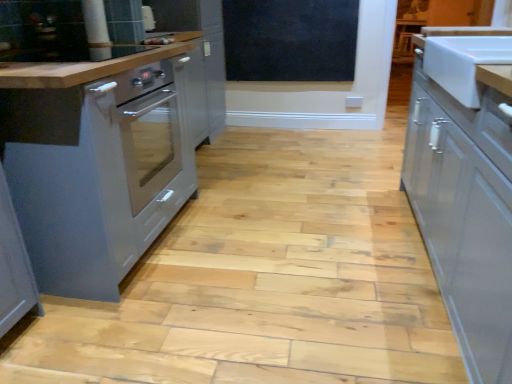
Question: Does white glossy sink at right have a lesser width compared to black matte chalkboard at upper center?

Choices:
 (A) no
 (B) yes

Answer: (A)

Question: From a real-world perspective, is white glossy sink at right physically below black matte chalkboard at upper center?

Choices:
 (A) no
 (B) yes

Answer: (A)

Question: Does white glossy sink at right have a greater width compared to black matte chalkboard at upper center?

Choices:
 (A) no
 (B) yes

Answer: (B)

Question: Can you confirm if white glossy sink at right is taller than black matte chalkboard at upper center?

Choices:
 (A) yes
 (B) no

Answer: (B)

Question: Is white glossy sink at right closer to the viewer compared to black matte chalkboard at upper center?

Choices:
 (A) yes
 (B) no

Answer: (A)

Question: Is point (449, 203) closer or farther from the camera than point (236, 21)?

Choices:
 (A) closer
 (B) farther

Answer: (A)

Question: Is white glossy cabinet at right, arranged as the second cabinetry when viewed from the left, bigger or smaller than black matte chalkboard at upper center?

Choices:
 (A) big
 (B) small

Answer: (A)

Question: From the image's perspective, is white glossy cabinet at right, placed as the 1th cabinetry when sorted from right to left, located above or below black matte chalkboard at upper center?

Choices:
 (A) above
 (B) below

Answer: (B)

Question: In the image, is white glossy cabinet at right, arranged as the second cabinetry when viewed from the left, positioned in front of or behind black matte chalkboard at upper center?

Choices:
 (A) front
 (B) behind

Answer: (A)

Question: From a real-world perspective, relative to black matte chalkboard at upper center, is white glossy sink at right vertically above or below?

Choices:
 (A) above
 (B) below

Answer: (A)

Question: From their relative heights in the image, would you say white glossy sink at right is taller or shorter than black matte chalkboard at upper center?

Choices:
 (A) short
 (B) tall

Answer: (A)

Question: Do you think white glossy sink at right is within black matte chalkboard at upper center, or outside of it?

Choices:
 (A) inside
 (B) outside

Answer: (B)

Question: In the image, is white glossy sink at right positioned in front of or behind black matte chalkboard at upper center?

Choices:
 (A) behind
 (B) front

Answer: (B)

Question: From a real-world perspective, is black matte chalkboard at upper center physically located above or below white glossy sink at right?

Choices:
 (A) above
 (B) below

Answer: (B)

Question: Is black matte chalkboard at upper center in front of or behind white glossy sink at right in the image?

Choices:
 (A) front
 (B) behind

Answer: (B)